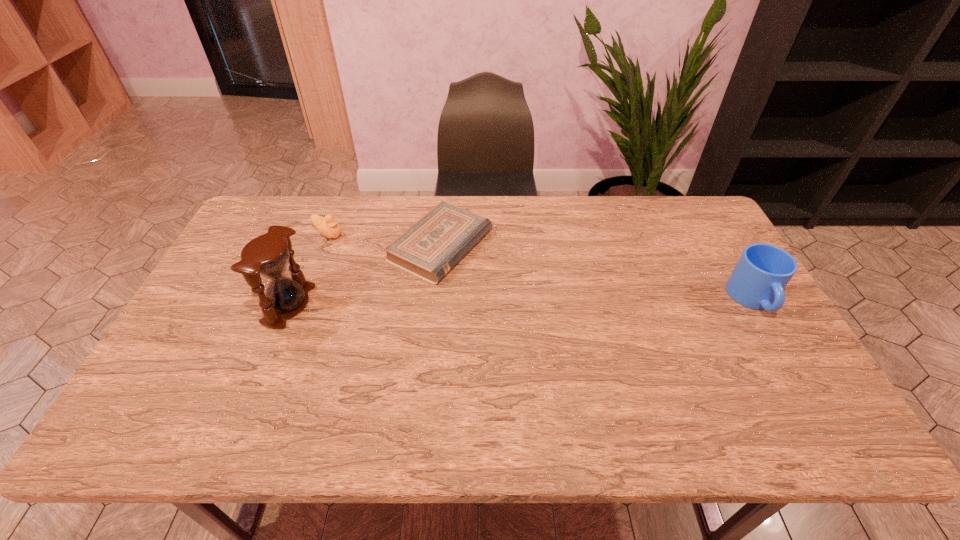
Find the location of `empty space between the tallest object and the mug`. empty space between the tallest object and the mug is located at coordinates (521, 302).

This screenshot has width=960, height=540. Find the location of `vacant space in between the shortest object and the mug`. vacant space in between the shortest object and the mug is located at coordinates (597, 273).

Select which object is the closest to the hourglass. Please provide its 2D coordinates. Your answer should be formatted as a tuple, i.e. [(x, y)], where the tuple contains the x and y coordinates of a point satisfying the conditions above.

[(327, 226)]

You are a GUI agent. You are given a task and a screenshot of the screen. Output one action in this format:
    pyautogui.click(x=<x>, y=<y>)
    Task: Click on the object that ranks as the second closest to the hourglass
    The width and height of the screenshot is (960, 540).
    Given the screenshot: What is the action you would take?
    pyautogui.click(x=429, y=249)

This screenshot has width=960, height=540. I want to click on free location that satisfies the following two spatial constraints: 1. on the front side of the shortest object; 2. on the left side of the duckling, so click(x=324, y=246).

Where is `vacant space that satisfies the following two spatial constraints: 1. on the back side of the duckling; 2. on the left side of the hourglass`? The height and width of the screenshot is (540, 960). vacant space that satisfies the following two spatial constraints: 1. on the back side of the duckling; 2. on the left side of the hourglass is located at coordinates (318, 234).